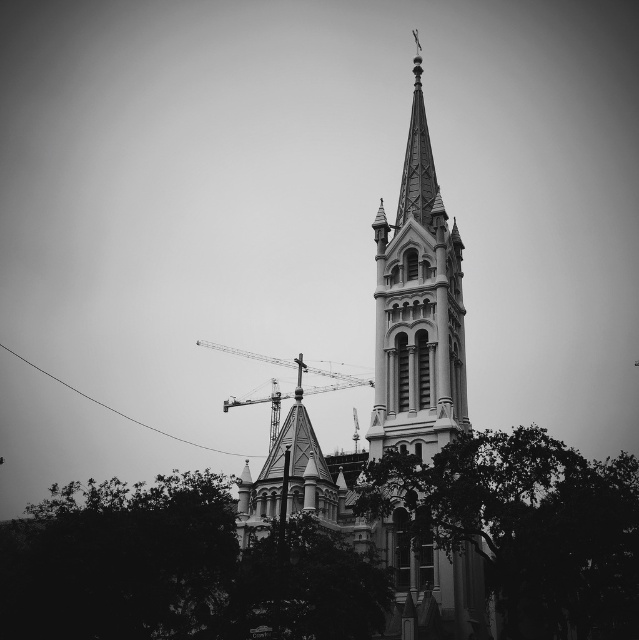
You are standing at the center of the image and want to take a photo of the polished stone church steeple at center. Since you are holding a camera with a 50mm lens, which has a field of view of 46 degrees, can you fit the entire steeple into your frame without moving? Explain your reasoning using the coordinates provided.

The polished stone church steeple at center is located at coordinates point [417,307]. Since the camera is at the center of the image and the steeple is also at the center, it would be within the 46 degree field of view of the 50mm lens, so yes, the entire steeple can be captured in the frame without moving.

You are standing at the edge of the churchyard and notice the green leafy tree at lower right and the metallic construction crane at center. Which object is closer to you from your current position?

The green leafy tree at lower right is closer to you because it is positioned under the metallic construction crane at center, indicating it is in a lower plane relative to your viewpoint.